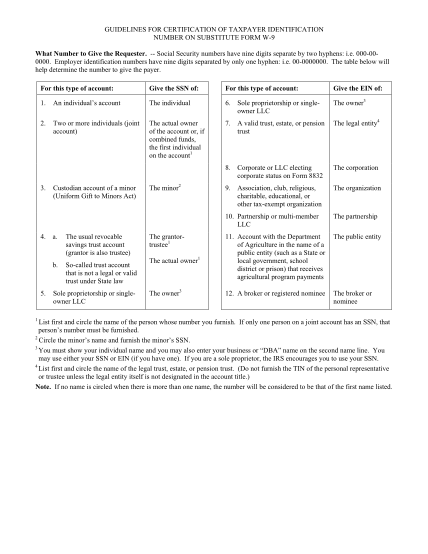
I want to click on column, so click(x=361, y=153).